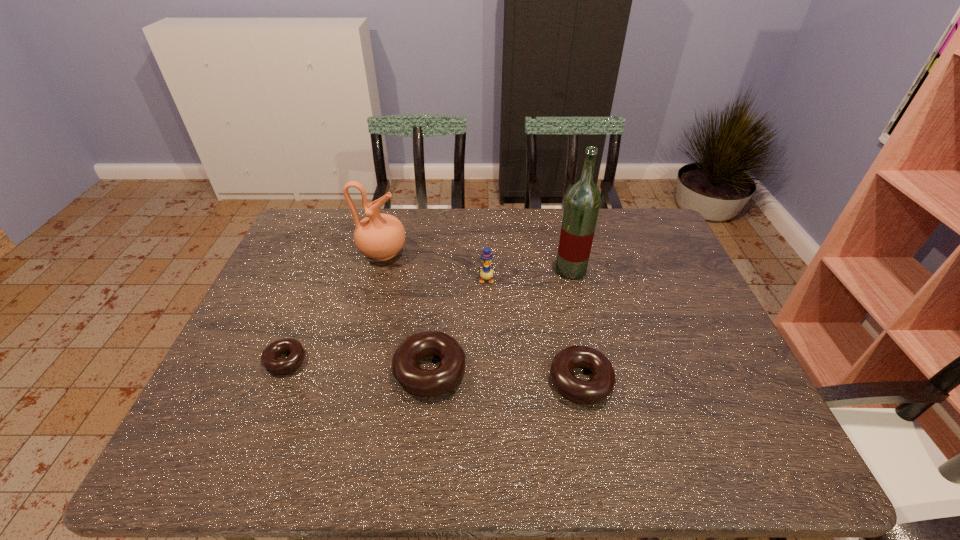
The image size is (960, 540). What are the coordinates of `empty location between the tallest object and the second shortest object` in the screenshot? It's located at (576, 326).

Find the location of a particular element. Image resolution: width=960 pixels, height=540 pixels. free spot between the third object from left to right and the liquor is located at coordinates (500, 320).

Identify the location of vacant area that lies between the leftmost object and the third object from left to right. This screenshot has height=540, width=960. (357, 366).

The height and width of the screenshot is (540, 960). Identify the location of vacant area that lies between the second object from left to right and the third object from left to right. (406, 312).

Locate an element on the screen. The image size is (960, 540). object that is the fifth closest to the second tallest object is located at coordinates (598, 388).

Choose which object is the second nearest neighbor to the fifth object from right to left. Please provide its 2D coordinates. Your answer should be formatted as a tuple, i.e. [(x, y)], where the tuple contains the x and y coordinates of a point satisfying the conditions above.

[(428, 383)]

Identify the location of doughnut that is the third closest to the third object from right to left. Image resolution: width=960 pixels, height=540 pixels. (269, 360).

This screenshot has height=540, width=960. In order to click on the closest doughnut relative to the liquor in this screenshot , I will do coord(598,388).

Locate an element on the screen. The height and width of the screenshot is (540, 960). free space that satisfies the following two spatial constraints: 1. on the spout of the third object from left to right; 2. on the left side of the fifth object from right to left is located at coordinates click(352, 371).

This screenshot has height=540, width=960. I want to click on vacant space that satisfies the following two spatial constraints: 1. on the spout of the pottery; 2. on the right side of the third object from left to right, so click(x=352, y=371).